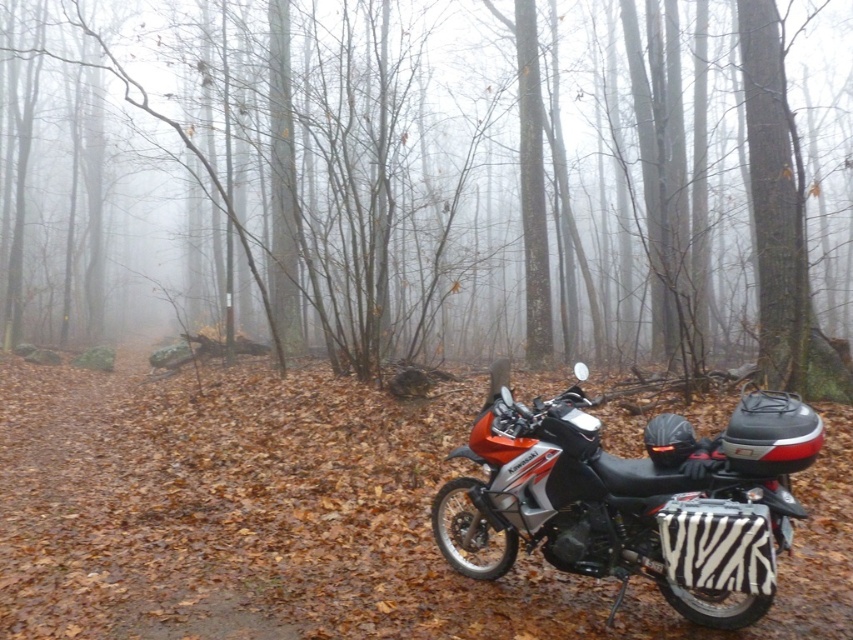
You are standing at the center of the forest and see the brown matte tree at center. If you walk straight ahead, will you eventually reach the motorcycle?

The brown matte tree at center is located at point [436,180], so if you walk straight ahead from the center, you will reach the motorcycle.

You are standing in the forest scene and want to walk towards the motorcycle. Which point, point [560,332] or point [544,534], will you encounter first?

You will encounter point [560,332] first because it is closer to you than point [544,534].